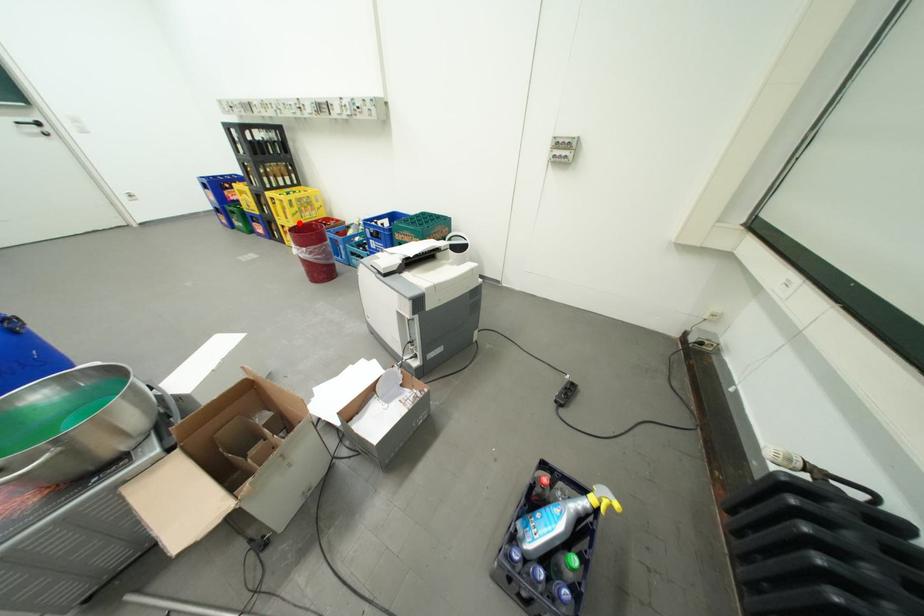
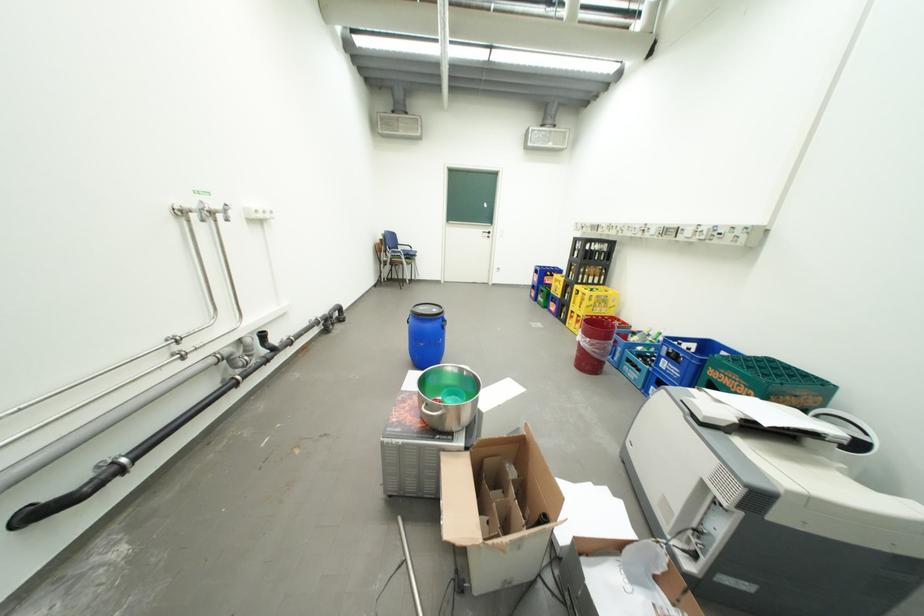
Find the pixel in the second image that matches the highlighted location in the first image.

(590, 312)